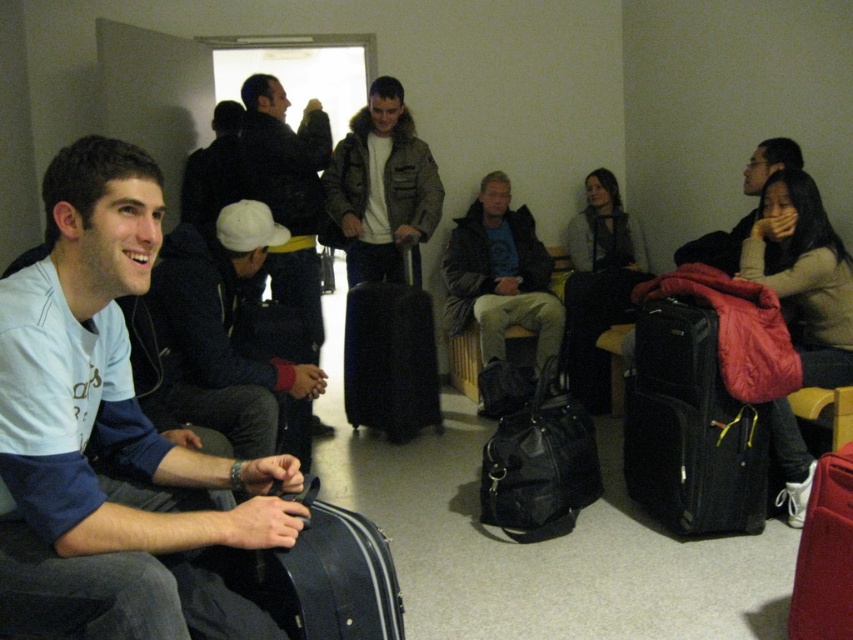
Is light blue fleece at left wider than dark gray fabric jacket at center?

No, light blue fleece at left is not wider than dark gray fabric jacket at center.

Does light blue fleece at left lie in front of dark gray fabric jacket at center?

Yes, it is.

Between point (177, 388) and point (611, 316), which one is positioned behind?

The point (611, 316) is behind.

You are a GUI agent. You are given a task and a screenshot of the screen. Output one action in this format:
    pyautogui.click(x=<x>, y=<y>)
    Task: Click on the light blue fleece at left
    
    Given the screenshot: What is the action you would take?
    pyautogui.click(x=216, y=339)

Between black leather suitcase at lower center and dark brown leather jacket at center, which one has less height?

black leather suitcase at lower center

Does black leather suitcase at lower center appear on the left side of dark brown leather jacket at center?

Indeed, black leather suitcase at lower center is positioned on the left side of dark brown leather jacket at center.

Which is behind, point (345, 508) or point (527, 285)?

The point (527, 285) is behind.

Locate an element on the screen. black leather suitcase at lower center is located at coordinates (332, 576).

What do you see at coordinates (689, 428) in the screenshot? This screenshot has height=640, width=853. I see `black fabric suitcase at right` at bounding box center [689, 428].

Does black fabric suitcase at right have a greater height compared to matte brown jacket at center?

No.

Is point (665, 513) closer to viewer compared to point (384, 216)?

Yes, point (665, 513) is in front of point (384, 216).

Where is `black fabric suitcase at right`? This screenshot has height=640, width=853. black fabric suitcase at right is located at coordinates (689, 428).